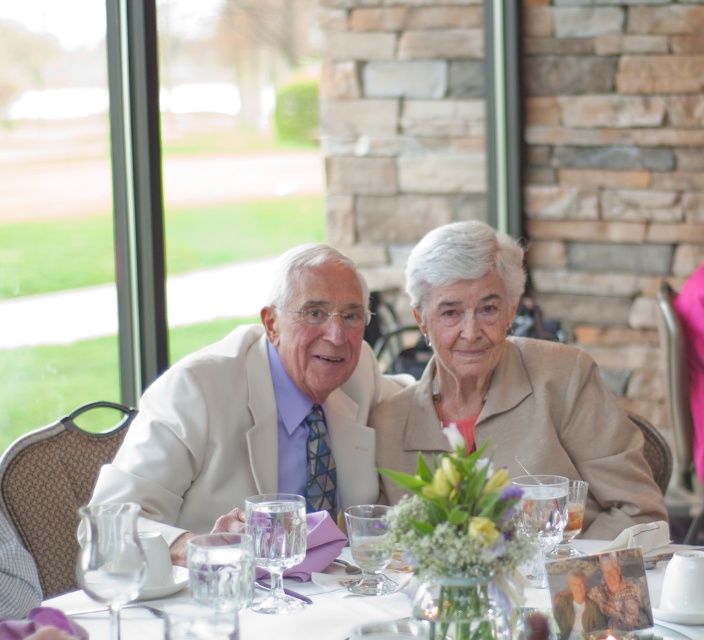
Question: Is beige fabric jacket at center thinner than white porcelain plate at lower center?

Choices:
 (A) yes
 (B) no

Answer: (A)

Question: Among these objects, which one is farthest from the camera?

Choices:
 (A) white fabric suit at center
 (B) beige fabric jacket at center
 (C) white porcelain plate at lower center

Answer: (B)

Question: Which object is the farthest from the white fabric suit at center?

Choices:
 (A) beige fabric jacket at center
 (B) white porcelain plate at lower center

Answer: (B)

Question: Is beige fabric jacket at center wider than white porcelain plate at lower center?

Choices:
 (A) no
 (B) yes

Answer: (A)

Question: Can you confirm if white fabric suit at center is smaller than white porcelain plate at lower center?

Choices:
 (A) no
 (B) yes

Answer: (A)

Question: Estimate the real-world distances between objects in this image. Which object is closer to the white fabric suit at center?

Choices:
 (A) white porcelain plate at lower center
 (B) beige fabric jacket at center

Answer: (B)